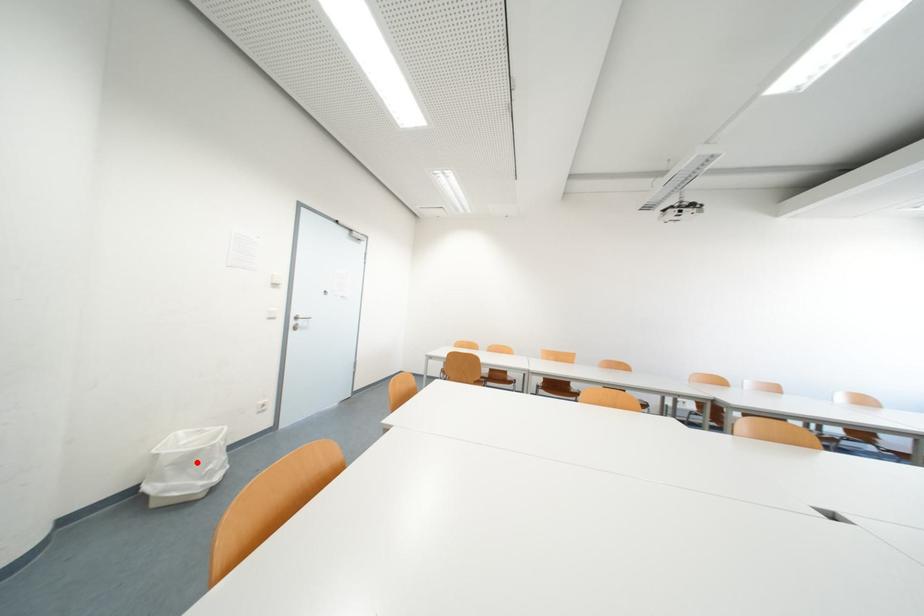
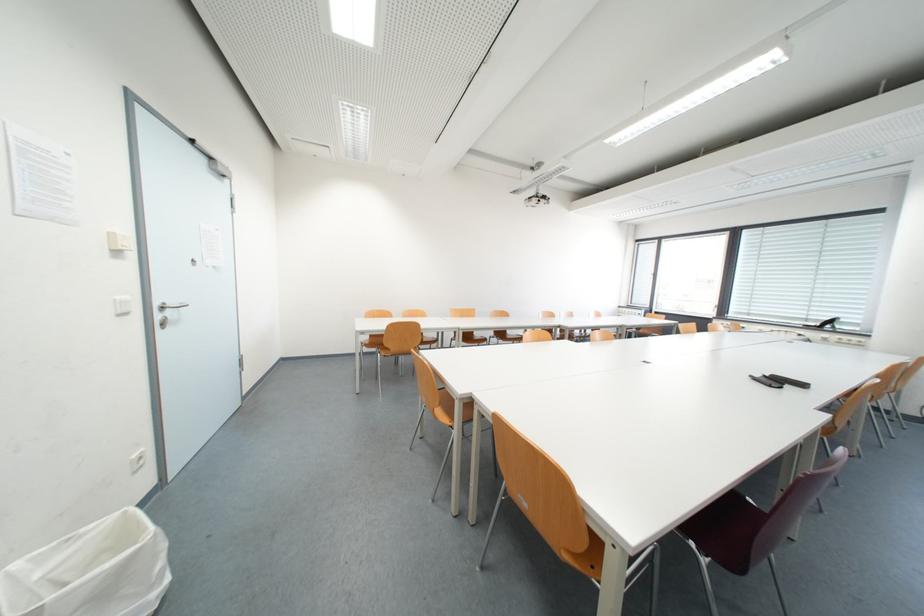
Question: I am providing you with two images of the same scene from different viewpoints. Image1 has a red point marked. In image2, the corresponding 3D location appears at what relative position? Reply with the corresponding letter.

Choices:
 (A) Closer
 (B) Farther

Answer: (A)